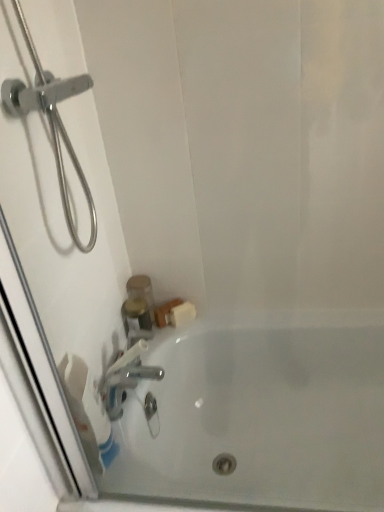
Find the location of a particular element. This screenshot has width=384, height=512. space that is in front of white matte toilet paper at lower left is located at coordinates (110, 490).